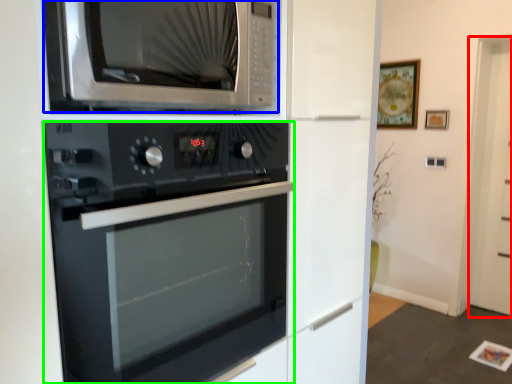
Question: Which object is positioned closest to glass door (highlighted by a red box)? Select from microwave oven (highlighted by a blue box) and oven (highlighted by a green box).

Choices:
 (A) microwave oven
 (B) oven

Answer: (B)